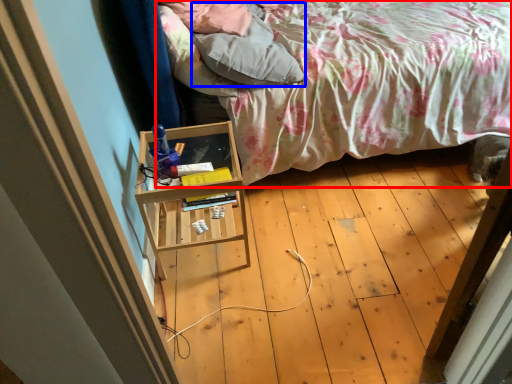
Question: Which of the following is the closest to the observer, bed (highlighted by a red box) or pillow (highlighted by a blue box)?

Choices:
 (A) bed
 (B) pillow

Answer: (A)